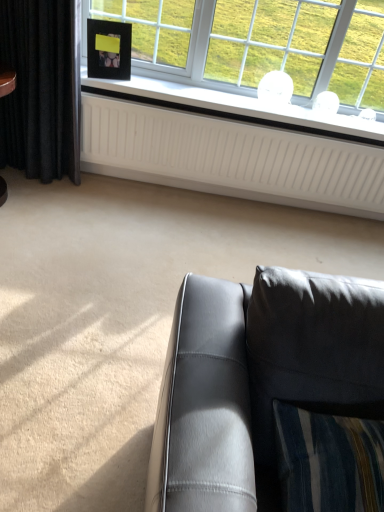
What do you see at coordinates (41, 88) in the screenshot?
I see `black velvet curtain at left` at bounding box center [41, 88].

I want to click on matte gray leather couch at lower right, so click(x=257, y=377).

The width and height of the screenshot is (384, 512). In order to click on white matte window sill at upper center in this screenshot , I will do `click(236, 108)`.

From a real-world perspective, is black velvet curtain at left above or below black matte picture frame at upper left?

From a real-world perspective, black velvet curtain at left is physically below black matte picture frame at upper left.

Considering the relative positions of black velvet curtain at left and black matte picture frame at upper left in the image provided, is black velvet curtain at left to the left or to the right of black matte picture frame at upper left?

black velvet curtain at left is to the left of black matte picture frame at upper left.

Between point (54, 7) and point (126, 35), which one is positioned in front?

The point (54, 7) is closer.

In terms of height, does black velvet curtain at left look taller or shorter compared to black matte picture frame at upper left?

In the image, black velvet curtain at left appears to be taller than black matte picture frame at upper left.

Measure the distance between black velvet curtain at left and matte gray leather couch at lower right.

black velvet curtain at left is 1.91 meters from matte gray leather couch at lower right.

Can you confirm if black velvet curtain at left is shorter than matte gray leather couch at lower right?

No, black velvet curtain at left is not shorter than matte gray leather couch at lower right.

Between black velvet curtain at left and matte gray leather couch at lower right, which one is positioned behind?

black velvet curtain at left is behind.

How many degrees apart are the facing directions of black velvet curtain at left and matte gray leather couch at lower right?

black velvet curtain at left and matte gray leather couch at lower right are facing 3.76 degrees away from each other.

Is matte gray leather couch at lower right not close to black matte picture frame at upper left?

Absolutely, matte gray leather couch at lower right is distant from black matte picture frame at upper left.

Considering the relative sizes of matte gray leather couch at lower right and black matte picture frame at upper left in the image provided, is matte gray leather couch at lower right taller than black matte picture frame at upper left?

Yes.

From the image's perspective, which is above, matte gray leather couch at lower right or black matte picture frame at upper left?

From the image's view, black matte picture frame at upper left is above.

How many degrees apart are the facing directions of matte gray leather couch at lower right and black matte picture frame at upper left?

25.1 degrees.

From the picture: Between white textured radiator at upper center and black velvet curtain at left, which one has more height?

black velvet curtain at left is taller.

Where is `radiator lying below the black velvet curtain at left (from the image's perspective)`? Image resolution: width=384 pixels, height=512 pixels. radiator lying below the black velvet curtain at left (from the image's perspective) is located at coordinates (230, 155).

Is point (148, 123) in front of point (53, 51)?

That is False.

Which object is positioned more to the right, white textured radiator at upper center or black velvet curtain at left?

white textured radiator at upper center is more to the right.

In terms of height, does matte gray leather couch at lower right look taller or shorter compared to black velvet curtain at left?

Considering their sizes, matte gray leather couch at lower right has less height than black velvet curtain at left.

Is point (190, 434) closer or farther from the camera than point (61, 19)?

Point (190, 434).

Considering the relative sizes of matte gray leather couch at lower right and black velvet curtain at left in the image provided, is matte gray leather couch at lower right wider than black velvet curtain at left?

Yes, matte gray leather couch at lower right is wider than black velvet curtain at left.

From a real-world perspective, between matte gray leather couch at lower right and black velvet curtain at left, who is vertically higher?

matte gray leather couch at lower right, from a real-world perspective.

Does matte gray leather couch at lower right have a greater width compared to white textured radiator at upper center?

Correct, the width of matte gray leather couch at lower right exceeds that of white textured radiator at upper center.

Is point (371, 395) closer or farther from the camera than point (230, 179)?

Point (371, 395) is positioned closer to the camera compared to point (230, 179).

Considering the relative sizes of matte gray leather couch at lower right and white textured radiator at upper center in the image provided, is matte gray leather couch at lower right bigger than white textured radiator at upper center?

Actually, matte gray leather couch at lower right might be smaller than white textured radiator at upper center.

Are black matte picture frame at upper left and white textured radiator at upper center far apart?

No, black matte picture frame at upper left is not far from white textured radiator at upper center.

From a real-world perspective, is black matte picture frame at upper left on top of white textured radiator at upper center?

Correct, in the physical world, black matte picture frame at upper left is higher than white textured radiator at upper center.

Is white textured radiator at upper center at the back of black matte picture frame at upper left?

No, black matte picture frame at upper left is not facing away from white textured radiator at upper center.

Considering the relative positions of black matte picture frame at upper left and white textured radiator at upper center in the image provided, is black matte picture frame at upper left to the left or to the right of white textured radiator at upper center?

Based on their positions, black matte picture frame at upper left is located to the left of white textured radiator at upper center.

This screenshot has height=512, width=384. Find the location of `picture frame that is above the black velvet curtain at left (from the image's perspective)`. picture frame that is above the black velvet curtain at left (from the image's perspective) is located at coordinates (109, 49).

In order to click on studio couch above the black velvet curtain at left (from a real-world perspective) in this screenshot , I will do `click(257, 377)`.

Considering their positions, is white textured radiator at upper center positioned closer to black velvet curtain at left than black matte picture frame at upper left?

black matte picture frame at upper left is positioned closer to the anchor black velvet curtain at left.

Estimate the real-world distances between objects in this image. Which object is closer to black velvet curtain at left, white textured radiator at upper center or white matte window sill at upper center?

Based on the image, white matte window sill at upper center appears to be nearer to black velvet curtain at left.

Estimate the real-world distances between objects in this image. Which object is closer to black matte picture frame at upper left, white textured radiator at upper center or white matte window sill at upper center?

white matte window sill at upper center lies closer to black matte picture frame at upper left than the other object.

Based on their spatial positions, is black matte picture frame at upper left or white matte window sill at upper center further from matte gray leather couch at lower right?

black matte picture frame at upper left is further to matte gray leather couch at lower right.

Estimate the real-world distances between objects in this image. Which object is further from white matte window sill at upper center, white textured radiator at upper center or matte gray leather couch at lower right?

matte gray leather couch at lower right lies further to white matte window sill at upper center than the other object.

Looking at the image, which one is located further to black matte picture frame at upper left, white matte window sill at upper center or black velvet curtain at left?

white matte window sill at upper center is further to black matte picture frame at upper left.

Considering their positions, is matte gray leather couch at lower right positioned closer to white matte window sill at upper center than black matte picture frame at upper left?

Based on the image, black matte picture frame at upper left appears to be nearer to white matte window sill at upper center.

Estimate the real-world distances between objects in this image. Which object is closer to black matte picture frame at upper left, matte gray leather couch at lower right or black velvet curtain at left?

black velvet curtain at left.

You are a GUI agent. You are given a task and a screenshot of the screen. Output one action in this format:
    pyautogui.click(x=<x>, y=<y>)
    Task: Click on the radiator located between matte gray leather couch at lower right and white matte window sill at upper center in the depth direction
    
    Given the screenshot: What is the action you would take?
    pyautogui.click(x=230, y=155)

Locate an element on the screen. The width and height of the screenshot is (384, 512). picture frame between matte gray leather couch at lower right and white textured radiator at upper center in the front-back direction is located at coordinates (109, 49).

At what (x,y) coordinates should I click in order to perform the action: click on picture frame located between black velvet curtain at left and white textured radiator at upper center in the left-right direction. Please return your answer as a coordinate pair (x, y). This screenshot has width=384, height=512. Looking at the image, I should click on (109, 49).

The image size is (384, 512). What are the coordinates of `picture frame positioned between matte gray leather couch at lower right and white matte window sill at upper center from near to far` in the screenshot? It's located at (109, 49).